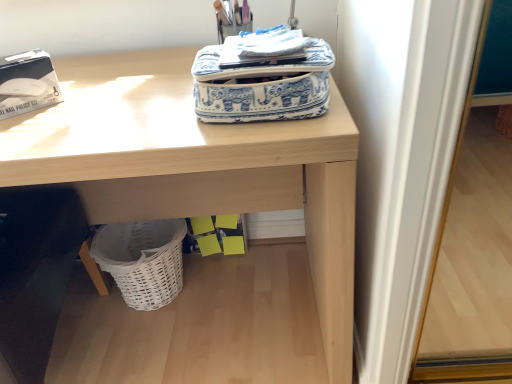
Locate an element on the screen. free location to the right of white wicker basket at lower left is located at coordinates (227, 287).